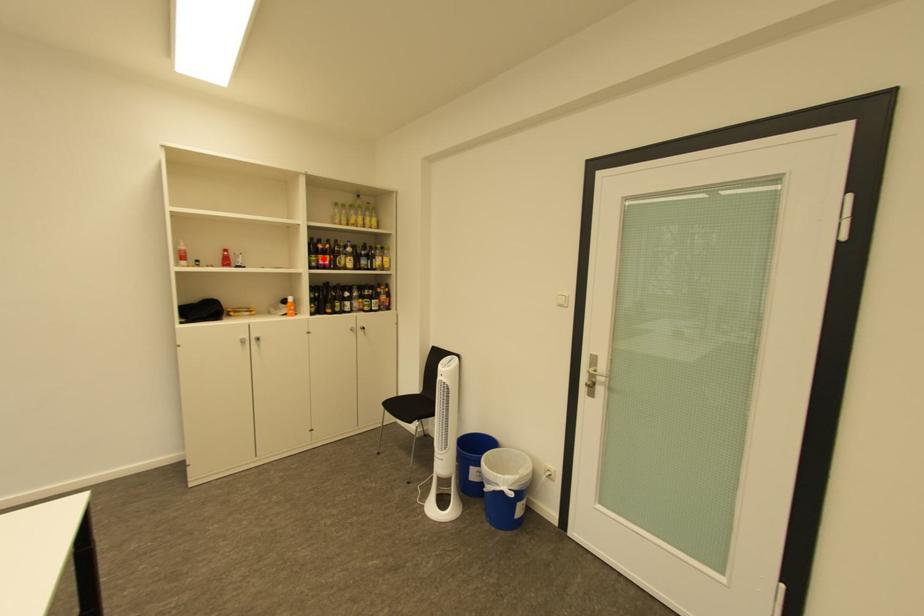
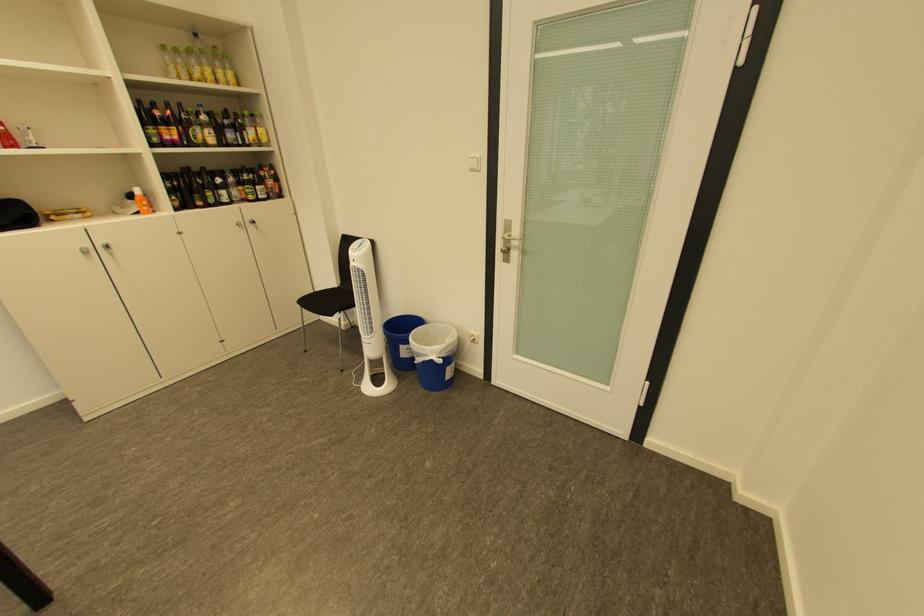
Question: I am providing you with two images of the same scene from different viewpoints. A red point is marked on the first image. Can you still see the location of the red point in image 2?

Choices:
 (A) Yes
 (B) No

Answer: (A)